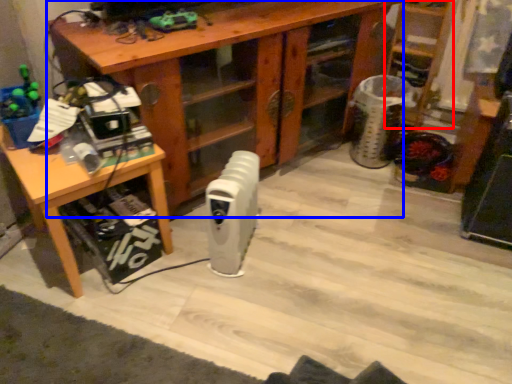
Question: Which point is further to the camera, shelf (highlighted by a red box) or desk (highlighted by a blue box)?

Choices:
 (A) shelf
 (B) desk

Answer: (A)